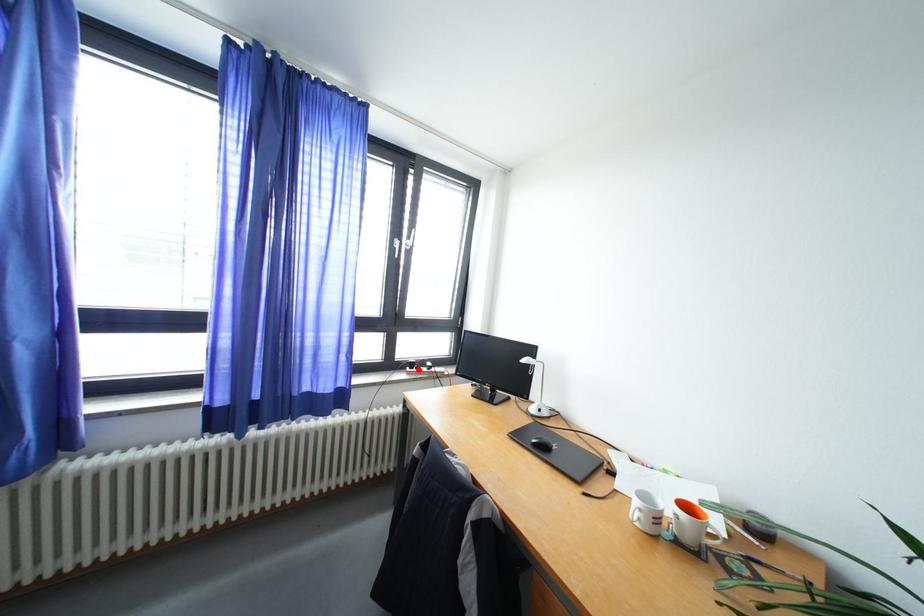
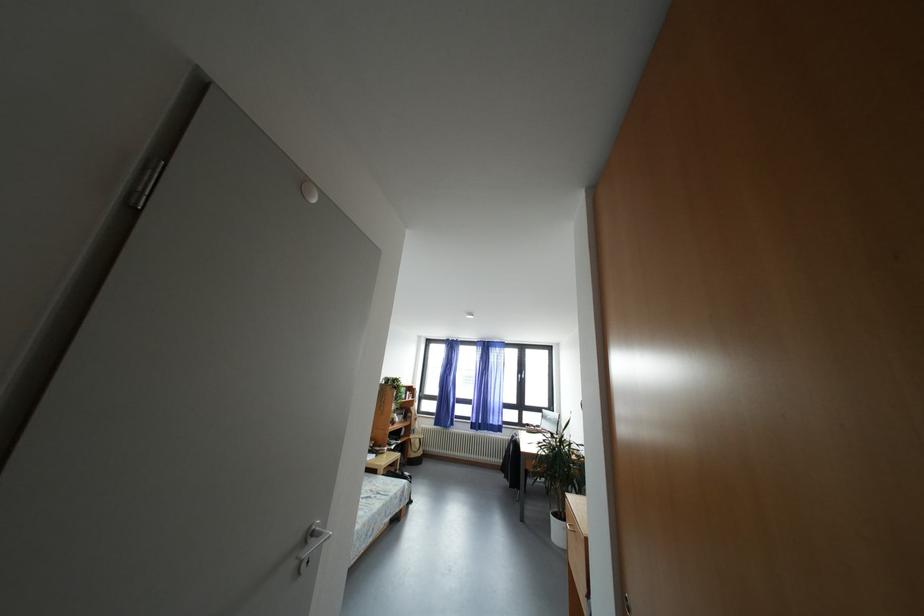
Question: A red point is marked in image1. In image2, is the corresponding 3D point closer to the camera or farther? Reply with the corresponding letter.

Choices:
 (A) The corresponding 3D point is closer.
 (B) The corresponding 3D point is farther.

Answer: (B)